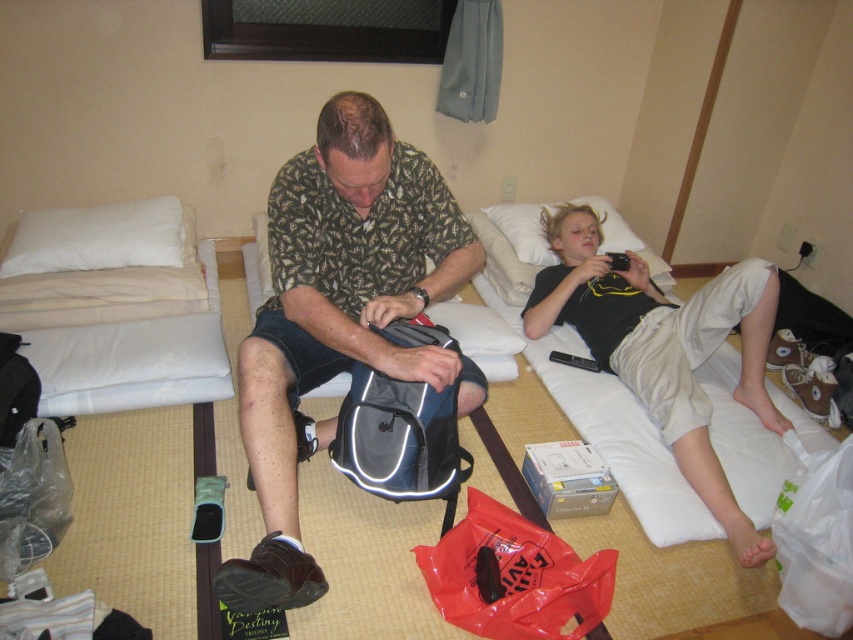
Question: Which object is positioned closest to the plastic bag at lower left?

Choices:
 (A) white plastic bag at lower right
 (B) black cotton shirt at upper right
 (C) gray fabric backpack at center
 (D) rubberized red bag at lower center

Answer: (C)

Question: Can you confirm if white plastic bag at lower right is positioned above white soft pillow at upper center?

Choices:
 (A) no
 (B) yes

Answer: (A)

Question: Which is nearer to the white soft pillow at upper center?

Choices:
 (A) plastic bag at lower left
 (B) black cotton shirt at upper right
 (C) rubberized red bag at lower center
 (D) white plastic bag at lower right

Answer: (B)

Question: Estimate the real-world distances between objects in this image. Which object is closer to the white soft pillow at upper left?

Choices:
 (A) white plastic bag at lower right
 (B) rubberized red bag at lower center
 (C) black cotton shirt at upper right
 (D) gray fabric backpack at center

Answer: (D)

Question: Does matte black backpack at center appear under white soft pillow at upper center?

Choices:
 (A) yes
 (B) no

Answer: (A)

Question: Can you confirm if rubberized red bag at lower center is positioned to the left of white plastic bag at lower right?

Choices:
 (A) no
 (B) yes

Answer: (B)